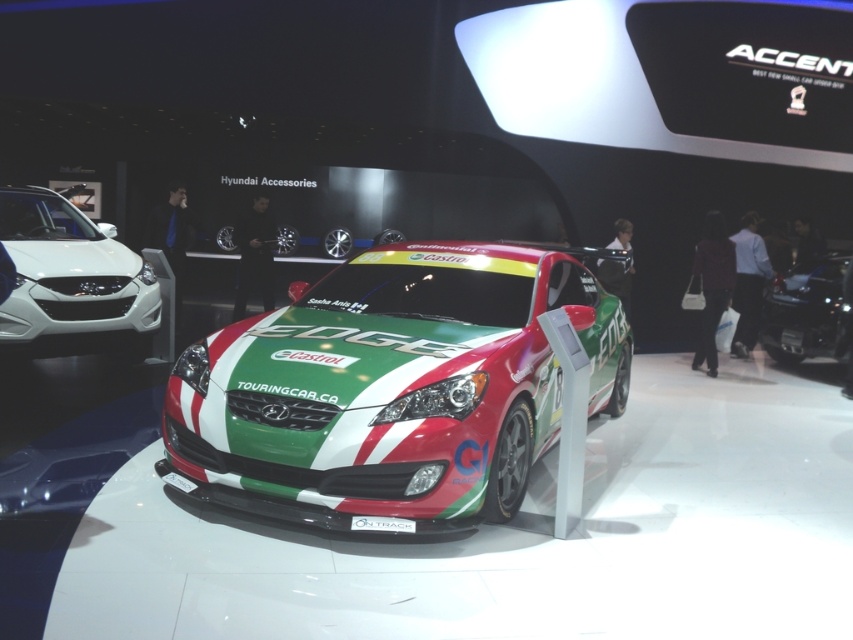
Question: Does white glossy sedan at left come behind white plastic license plate at center?

Choices:
 (A) yes
 (B) no

Answer: (A)

Question: Which object appears closest to the camera in this image?

Choices:
 (A) shiny black car at center
 (B) shiny metallic race car at center

Answer: (B)

Question: In this image, where is shiny metallic race car at center located relative to white plastic license plate at center?

Choices:
 (A) above
 (B) below

Answer: (A)

Question: Which point is farther to the camera?

Choices:
 (A) (366, 520)
 (B) (144, 291)

Answer: (B)

Question: Is white glossy sedan at left positioned behind shiny black car at center?

Choices:
 (A) no
 (B) yes

Answer: (A)

Question: Which of these objects is positioned farthest from the white plastic license plate at center?

Choices:
 (A) white glossy sedan at left
 (B) shiny black car at center
 (C) shiny metallic race car at center

Answer: (B)